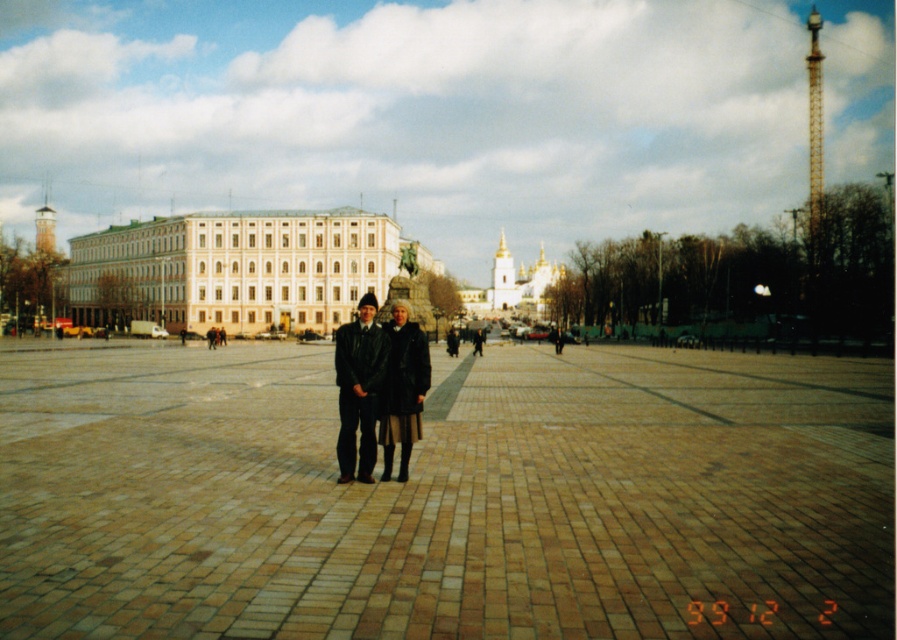
Question: Does leather jacket at center appear on the left side of dark brown leather coat at center?

Choices:
 (A) no
 (B) yes

Answer: (B)

Question: Which object is positioned closest to the dark brown leather coat at center?

Choices:
 (A) white smooth building at center
 (B) golden domed church at center

Answer: (A)

Question: Is white smooth building at center above golden domed church at center?

Choices:
 (A) no
 (B) yes

Answer: (A)

Question: Which object appears closest to the camera in this image?

Choices:
 (A) golden domed church at center
 (B) leather jacket at center
 (C) white smooth building at center
 (D) dark brown leather coat at center

Answer: (B)

Question: Which object appears farthest from the camera in this image?

Choices:
 (A) golden domed church at center
 (B) leather jacket at center
 (C) white smooth building at center
 (D) dark brown leather coat at center

Answer: (A)

Question: In this image, where is white smooth building at center located relative to dark brown leather coat at center?

Choices:
 (A) below
 (B) above

Answer: (B)